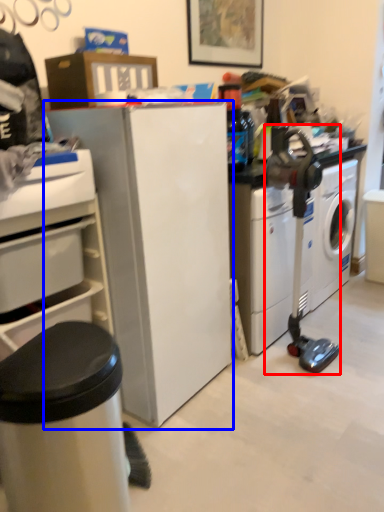
Question: Which object is further to the camera taking this photo, sewing machine (highlighted by a red box) or refrigerator (highlighted by a blue box)?

Choices:
 (A) sewing machine
 (B) refrigerator

Answer: (A)